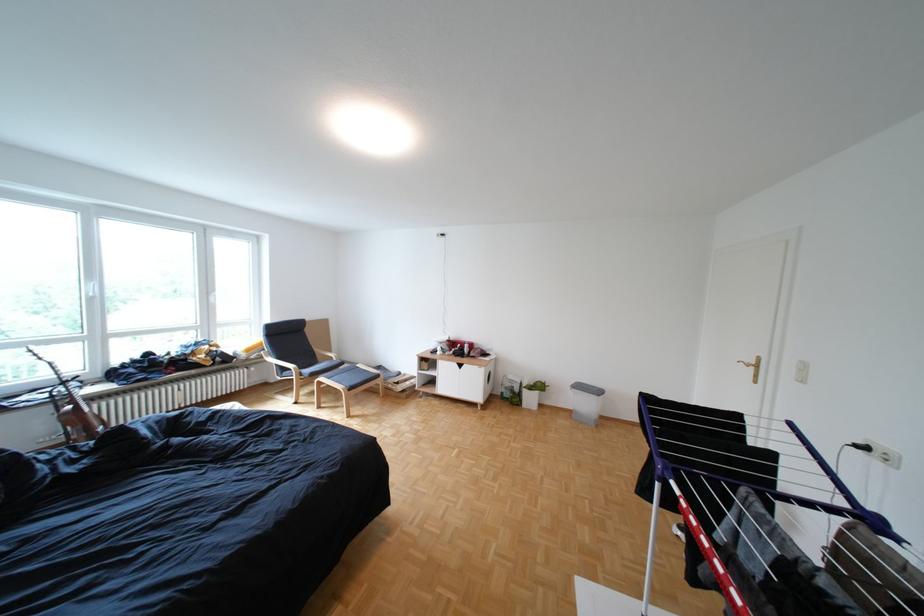
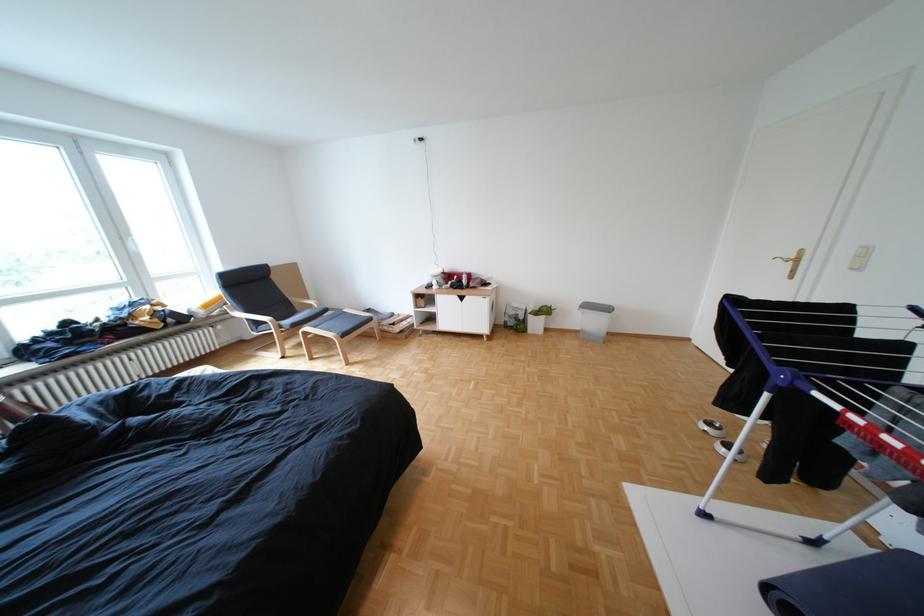
Locate, in the second image, the point that corresponds to pixel 322 371 in the first image.

(301, 323)